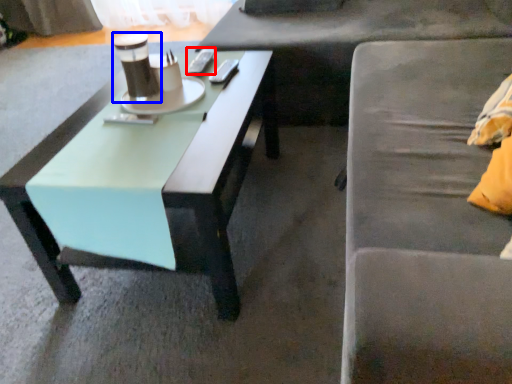
Question: Which point is further to the camera, remote control (highlighted by a red box) or coffee cup (highlighted by a blue box)?

Choices:
 (A) remote control
 (B) coffee cup

Answer: (A)